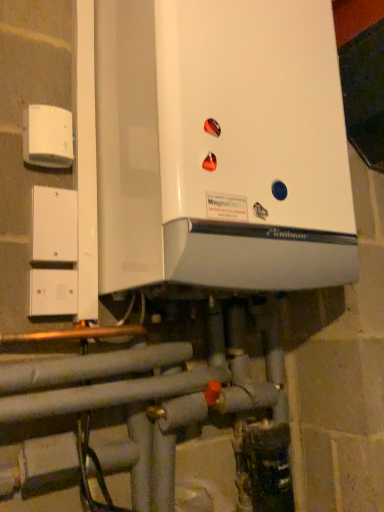
Question: Is white glossy boiler at center closer to camera compared to white plastic/light switch at left?

Choices:
 (A) yes
 (B) no

Answer: (A)

Question: Considering the relative sizes of white glossy boiler at center and white plastic/light switch at left in the image provided, is white glossy boiler at center shorter than white plastic/light switch at left?

Choices:
 (A) yes
 (B) no

Answer: (B)

Question: From the image's perspective, is white glossy boiler at center on white plastic/light switch at left?

Choices:
 (A) yes
 (B) no

Answer: (A)

Question: Is white plastic/light switch at left surrounded by white glossy boiler at center?

Choices:
 (A) yes
 (B) no

Answer: (B)

Question: Does white glossy boiler at center have a larger size compared to white plastic/light switch at left?

Choices:
 (A) yes
 (B) no

Answer: (A)

Question: From the image's perspective, would you say white glossy boiler at center is shown under white plastic/light switch at left?

Choices:
 (A) no
 (B) yes

Answer: (A)

Question: Is white plastic electric outlet at upper left located outside white plastic/light switch at left?

Choices:
 (A) no
 (B) yes

Answer: (B)

Question: Is white plastic electric outlet at upper left shorter than white plastic/light switch at left?

Choices:
 (A) no
 (B) yes

Answer: (B)

Question: Can you confirm if white plastic electric outlet at upper left is positioned to the right of white plastic/light switch at left?

Choices:
 (A) no
 (B) yes

Answer: (A)

Question: Is the surface of white plastic electric outlet at upper left in direct contact with white plastic/light switch at left?

Choices:
 (A) yes
 (B) no

Answer: (B)

Question: Considering the relative positions of white plastic electric outlet at upper left and white plastic/light switch at left in the image provided, is white plastic electric outlet at upper left in front of white plastic/light switch at left?

Choices:
 (A) yes
 (B) no

Answer: (A)

Question: Can white plastic/light switch at left be found inside white plastic electric outlet at upper left?

Choices:
 (A) yes
 (B) no

Answer: (B)

Question: Does white plastic/light switch at left turn towards white plastic electric outlet at upper left?

Choices:
 (A) yes
 (B) no

Answer: (B)